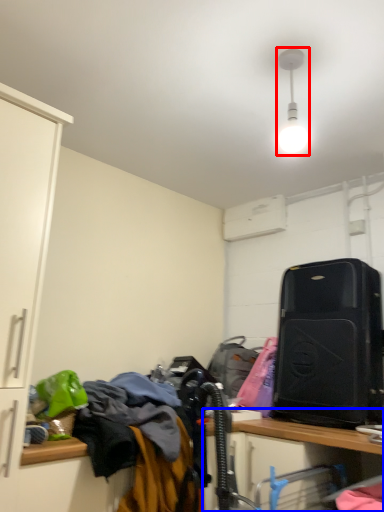
Question: Which point is further to the camera, light fixture (highlighted by a red box) or computer desk (highlighted by a blue box)?

Choices:
 (A) light fixture
 (B) computer desk

Answer: (A)